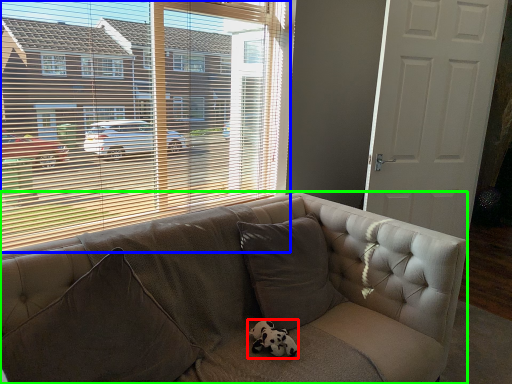
Question: Estimate the real-world distances between objects in this image. Which object is farther from animal (highlighted by a red box), window (highlighted by a blue box) or studio couch (highlighted by a green box)?

Choices:
 (A) window
 (B) studio couch

Answer: (A)